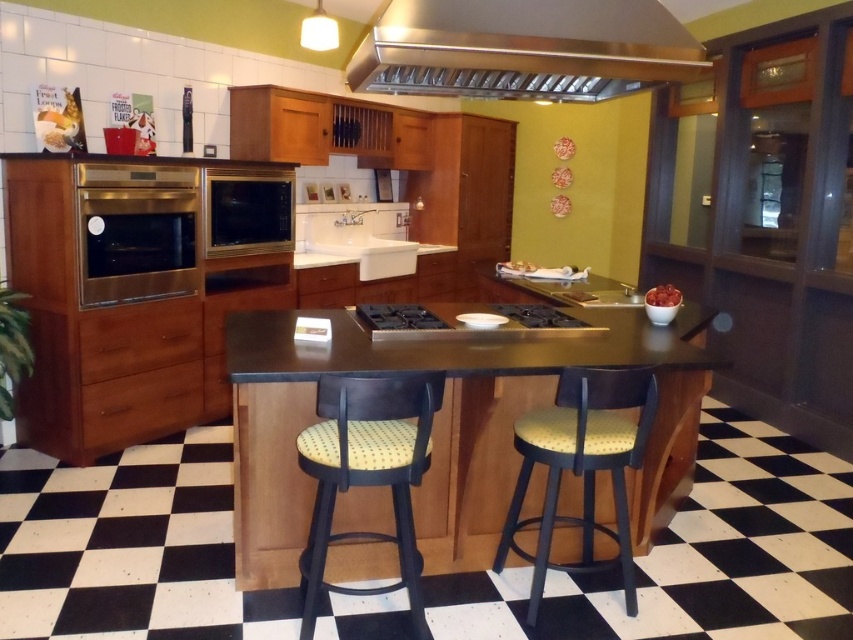
Is satin gold microwave at center below black glass cooktop at center?

Actually, satin gold microwave at center is above black glass cooktop at center.

Does satin gold microwave at center have a greater height compared to black glass cooktop at center?

Answer: Yes, satin gold microwave at center is taller than black glass cooktop at center.

Locate an element on the screen. satin gold microwave at center is located at coordinates (247, 211).

Is satin gold microwave at center closer to camera compared to black stainless steel stove at center?

No, it is behind black stainless steel stove at center.

Is satin gold microwave at center taller than black stainless steel stove at center?

Yes, satin gold microwave at center is taller than black stainless steel stove at center.

Find the location of a particular element. The image size is (853, 640). satin gold microwave at center is located at coordinates (247, 211).

Looking at this image, is stainless steel oven at left taller than satin gold microwave at center?

Yes.

Which is in front, point (82, 205) or point (234, 237)?

Point (82, 205) is in front.

This screenshot has width=853, height=640. Identify the location of stainless steel oven at left. pos(136,232).